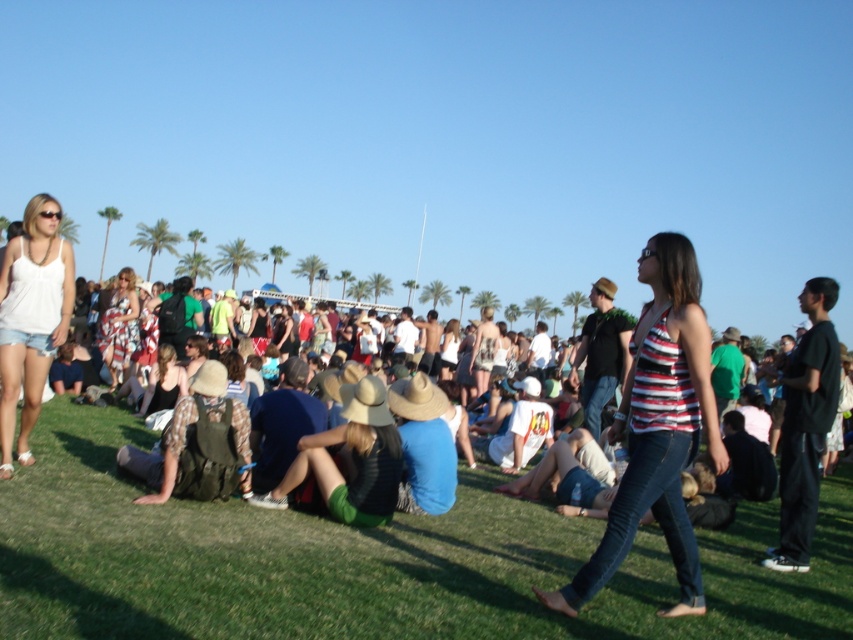
Question: Which point is farther from the camera taking this photo?

Choices:
 (A) (126, 337)
 (B) (148, 385)

Answer: (A)

Question: Which of the following is the closest to the observer?

Choices:
 (A) (154, 369)
 (B) (322, 481)
 (C) (115, 358)
 (D) (643, 337)

Answer: (D)

Question: Is the position of matte white tank top at lower left less distant than that of matte black tank top at center?

Choices:
 (A) yes
 (B) no

Answer: (A)

Question: Which object appears farthest from the camera in this image?

Choices:
 (A) printed cotton dress at center
 (B) matte white tank top at lower left

Answer: (A)

Question: Can you confirm if matte white tank top at lower left is thinner than green fabric hat at center?

Choices:
 (A) yes
 (B) no

Answer: (B)

Question: From the image, what is the correct spatial relationship of striped fabric tank top at center in relation to matte white tank top at lower left?

Choices:
 (A) below
 (B) above

Answer: (A)